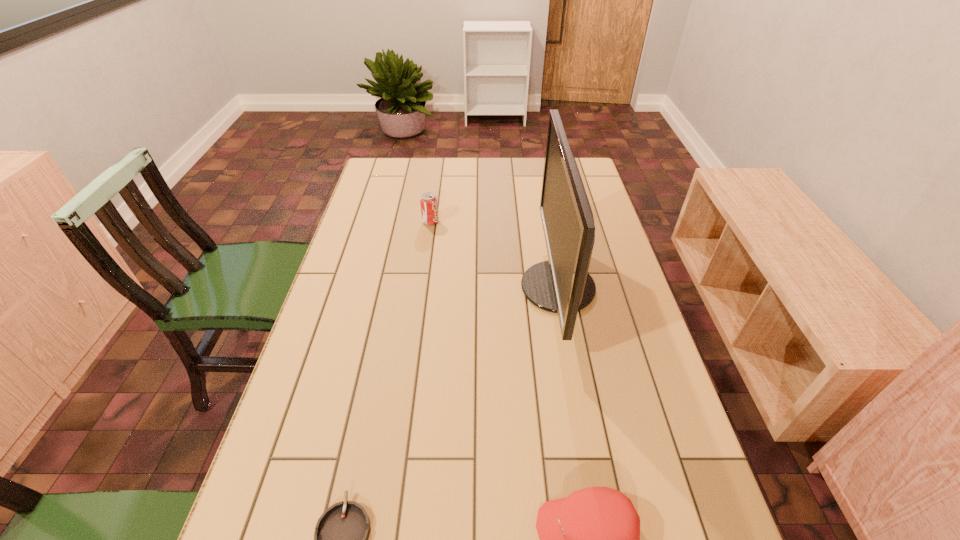
This screenshot has width=960, height=540. What are the coordinates of `vacant space at the left edge` in the screenshot? It's located at (295, 457).

You are a GUI agent. You are given a task and a screenshot of the screen. Output one action in this format:
    pyautogui.click(x=<x>, y=<y>)
    Task: Click on the free space at the right edge of the desktop
    The width and height of the screenshot is (960, 540).
    Given the screenshot: What is the action you would take?
    pyautogui.click(x=665, y=383)

What are the coordinates of `vacant space at the far left corner of the desktop` in the screenshot? It's located at (369, 184).

Identify the location of vacant area that lies between the tallest object and the soda can. point(494,255).

The image size is (960, 540). In order to click on free space between the tallest object and the soda can in this screenshot , I will do click(494, 255).

Identify the location of free space between the tallest object and the second object from left to right. Image resolution: width=960 pixels, height=540 pixels. (494, 255).

Locate an element on the screen. The image size is (960, 540). vacant region between the tallest object and the third shortest object is located at coordinates (494, 255).

Locate an element on the screen. object that is the second closest to the ashtray is located at coordinates (562, 285).

Find the location of a particular element. This screenshot has width=960, height=540. object that is the second nearest to the second shortest object is located at coordinates (562, 285).